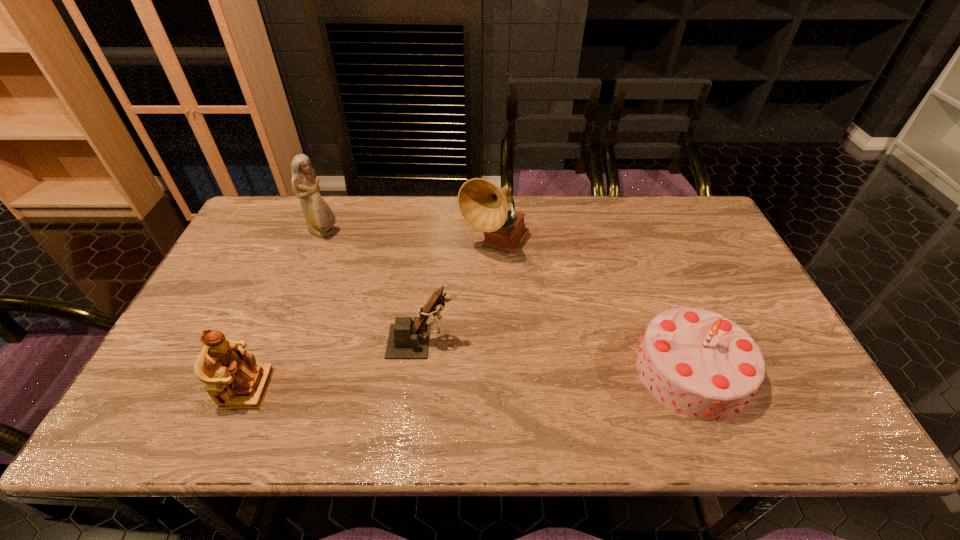
Where is `free location that satisfies the following two spatial constraints: 1. on the back side of the rightmost object; 2. on the front-facing side of the rightmost figurine`? Image resolution: width=960 pixels, height=540 pixels. free location that satisfies the following two spatial constraints: 1. on the back side of the rightmost object; 2. on the front-facing side of the rightmost figurine is located at coordinates (680, 342).

What are the coordinates of `blank space that satisfies the following two spatial constraints: 1. on the front-facing side of the birthday cake; 2. on the right side of the farthest figurine` in the screenshot? It's located at (269, 371).

This screenshot has height=540, width=960. What are the coordinates of `free point that satisfies the following two spatial constraints: 1. on the horn of the phonograph record; 2. on the left side of the birthday cake` in the screenshot? It's located at (499, 371).

Identify the location of vacant area that satisfies the following two spatial constraints: 1. on the front-facing side of the birthday cake; 2. on the right side of the rightmost figurine. (419, 371).